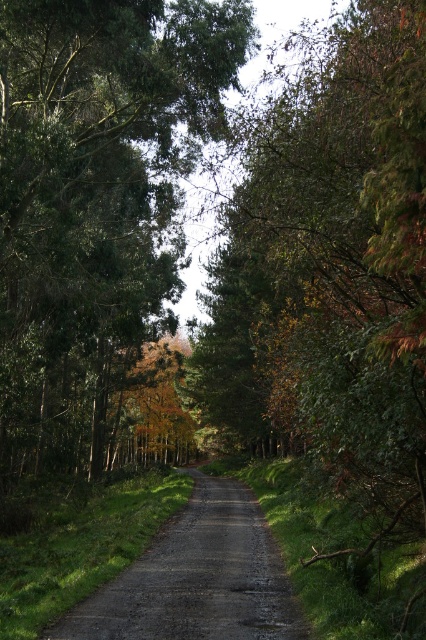
You are a hiker walking along the forest path and want to take a photo of the green matte tree at center and the dull gray gravel road at center. Which object should you position to your left side in the camera frame to capture both in the shot?

To capture both the green matte tree at center and the dull gray gravel road at center in the shot, you should position the green matte tree at center to your left side in the camera frame since it is already located to the left of the dull gray gravel road at center.

You are a hiker planning to walk along the forest path. You notice the green matte tree at center and the dull gray gravel road at center. Which object is higher in the scene?

The green matte tree at center is above the dull gray gravel road at center, so the green matte tree at center is higher in the scene.